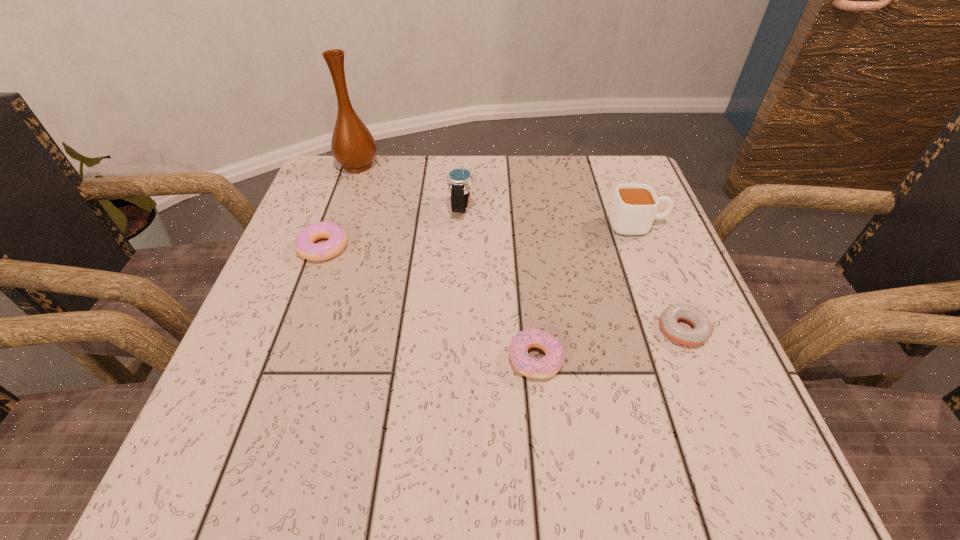
The image size is (960, 540). Find the location of `vase`. vase is located at coordinates (353, 146).

Find the location of a particular element. the farthest object is located at coordinates (353, 146).

Identify the location of watch. (459, 180).

Where is `cup`? This screenshot has height=540, width=960. cup is located at coordinates (633, 209).

You are a GUI agent. You are given a task and a screenshot of the screen. Output one action in this format:
    pyautogui.click(x=<x>, y=<y>)
    Task: Click on the leftmost doughnut
    The image size is (960, 540).
    Given the screenshot: What is the action you would take?
    click(x=304, y=244)

What are the coordinates of `the third object from right to left` in the screenshot? It's located at (538, 368).

The width and height of the screenshot is (960, 540). Identify the location of the rightmost doughnut. (702, 328).

At what (x,y) coordinates should I click in order to perform the action: click on the shortest doughnut. Please return your answer as a coordinate pair (x, y). Looking at the image, I should click on (702, 328).

Where is `free space located 0.290m on the right of the tallest object`? free space located 0.290m on the right of the tallest object is located at coordinates (493, 165).

Image resolution: width=960 pixels, height=540 pixels. I want to click on free space located 0.050m on the right of the fourth object from right to left, so click(500, 207).